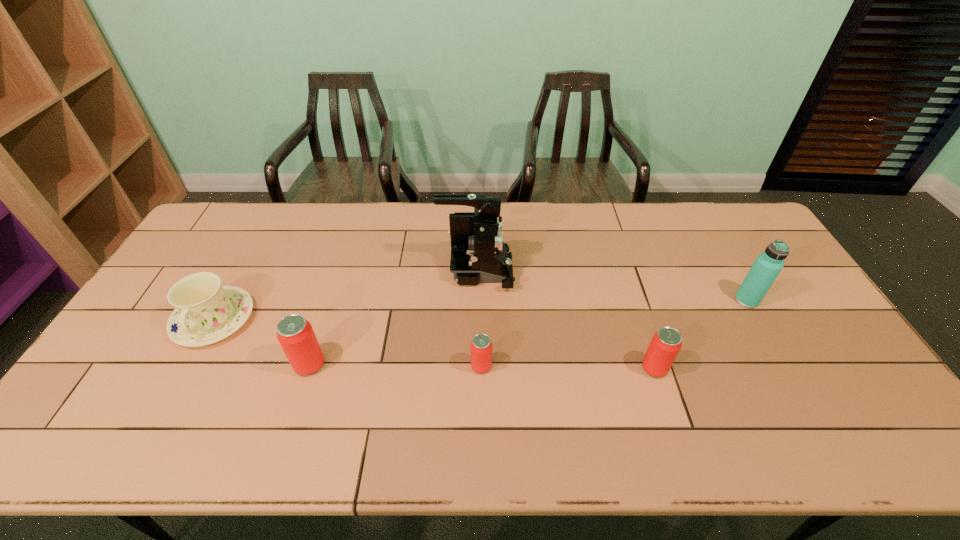
Identify the location of free space between the second beer can from left to right and the thermos bottle. (614, 333).

Identify the location of vacant area that lies between the chinaware and the camcorder. The height and width of the screenshot is (540, 960). (345, 295).

At what (x,y) coordinates should I click in order to perform the action: click on vacant area that lies between the fifth shortest object and the fifth object from right to left. Please return your answer as a coordinate pair (x, y). Looking at the image, I should click on (528, 333).

The image size is (960, 540). Identify the location of free space between the leftmost object and the second shortest beer can. (434, 344).

Point out which object is positioned as the third nearest to the second beer can from left to right. Please provide its 2D coordinates. Your answer should be formatted as a tuple, i.e. [(x, y)], where the tuple contains the x and y coordinates of a point satisfying the conditions above.

[(666, 343)]

Find the location of a particular element. Image resolution: width=960 pixels, height=540 pixels. the third closest object to the chinaware is located at coordinates (481, 346).

This screenshot has width=960, height=540. I want to click on beer can that is the closest to the rightmost object, so click(x=666, y=343).

Image resolution: width=960 pixels, height=540 pixels. I want to click on the closest beer can to the second tallest beer can, so click(481, 346).

Locate an element on the screen. This screenshot has width=960, height=540. free space that satisfies the following two spatial constraints: 1. on the lens mount of the shortest beer can; 2. on the right side of the camcorder is located at coordinates (475, 366).

This screenshot has width=960, height=540. In order to click on vacant area in the image that satisfies the following two spatial constraints: 1. on the back side of the rightmost object; 2. on the right side of the second object from right to left in this screenshot , I will do `click(633, 300)`.